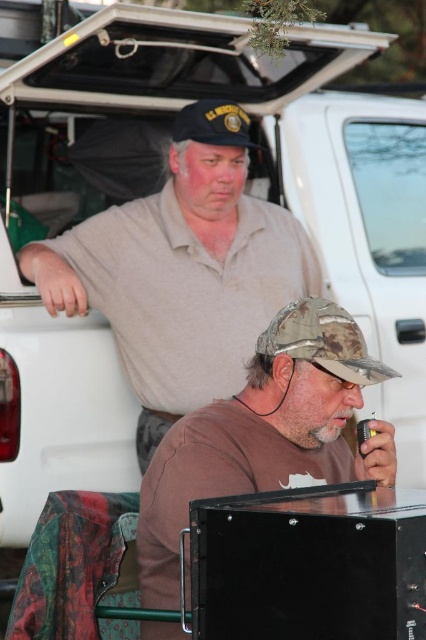
Looking at this image, which is below, light brown cotton shirt at upper center or brown matte shirt at lower center?

Positioned lower is brown matte shirt at lower center.

Between point (144, 272) and point (308, 362), which one is positioned behind?

Point (144, 272)

What do you see at coordinates (183, 272) in the screenshot?
I see `light brown cotton shirt at upper center` at bounding box center [183, 272].

The image size is (426, 640). I want to click on light brown cotton shirt at upper center, so click(183, 272).